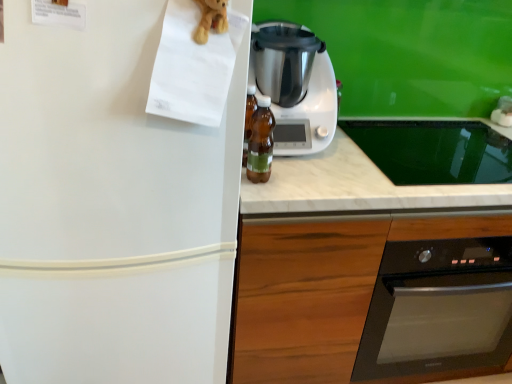
Question: From the image's perspective, does white matte refrigerator at left appear lower than wooden at center?

Choices:
 (A) no
 (B) yes

Answer: (A)

Question: Can you confirm if white matte refrigerator at left is bigger than wooden at center?

Choices:
 (A) no
 (B) yes

Answer: (A)

Question: Is white matte refrigerator at left wider than wooden at center?

Choices:
 (A) no
 (B) yes

Answer: (B)

Question: Is white matte refrigerator at left at the left side of wooden at center?

Choices:
 (A) yes
 (B) no

Answer: (A)

Question: Is white matte refrigerator at left outside of wooden at center?

Choices:
 (A) no
 (B) yes

Answer: (B)

Question: Is white plastic blender at center in front of or behind wooden at center in the image?

Choices:
 (A) behind
 (B) front

Answer: (A)

Question: From a real-world perspective, is white plastic blender at center physically located above or below wooden at center?

Choices:
 (A) below
 (B) above

Answer: (B)

Question: Considering the positions of white plastic blender at center and wooden at center in the image, is white plastic blender at center bigger or smaller than wooden at center?

Choices:
 (A) big
 (B) small

Answer: (B)

Question: Choose the correct answer: Is white plastic blender at center inside wooden at center or outside it?

Choices:
 (A) inside
 (B) outside

Answer: (B)

Question: Is brown plush toy at upper left wider or thinner than translucent amber bottle at center?

Choices:
 (A) wide
 (B) thin

Answer: (B)

Question: From the image's perspective, is brown plush toy at upper left located above or below translucent amber bottle at center?

Choices:
 (A) above
 (B) below

Answer: (A)

Question: From their relative heights in the image, would you say brown plush toy at upper left is taller or shorter than translucent amber bottle at center?

Choices:
 (A) tall
 (B) short

Answer: (B)

Question: Considering the positions of point (202, 16) and point (254, 129), is point (202, 16) closer or farther from the camera than point (254, 129)?

Choices:
 (A) closer
 (B) farther

Answer: (A)

Question: Considering the relative positions of translucent amber bottle at center and white marble countertop at center in the image provided, is translucent amber bottle at center to the left or to the right of white marble countertop at center?

Choices:
 (A) left
 (B) right

Answer: (A)

Question: From their relative heights in the image, would you say translucent amber bottle at center is taller or shorter than white marble countertop at center?

Choices:
 (A) short
 (B) tall

Answer: (B)